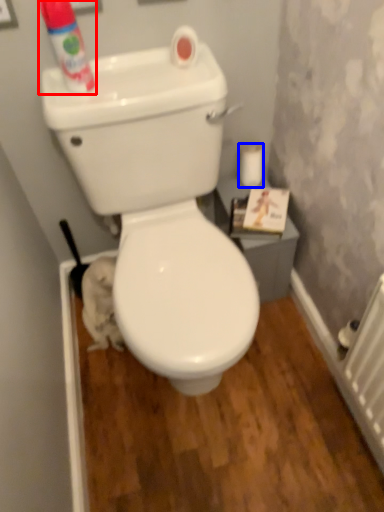
Question: Which point is closer to the camera, cleaning product (highlighted by a red box) or toilet paper (highlighted by a blue box)?

Choices:
 (A) cleaning product
 (B) toilet paper

Answer: (A)